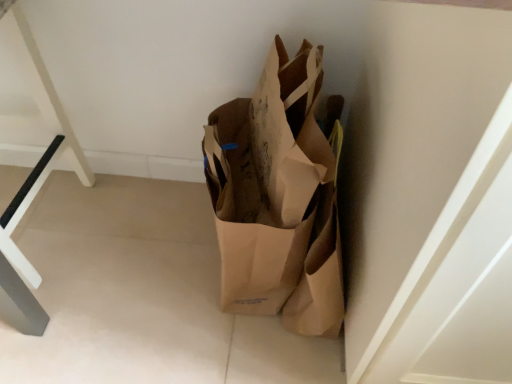
Question: Is point (28, 314) closer or farther from the camera than point (286, 79)?

Choices:
 (A) closer
 (B) farther

Answer: (B)

Question: From a real-world perspective, is white plastic table at left positioned above or below brown paper bag at center?

Choices:
 (A) below
 (B) above

Answer: (B)

Question: Would you say white plastic table at left is to the left or to the right of brown paper bag at center in the picture?

Choices:
 (A) left
 (B) right

Answer: (A)

Question: Considering the positions of brown paper bag at center and white plastic table at left in the image, is brown paper bag at center wider or thinner than white plastic table at left?

Choices:
 (A) thin
 (B) wide

Answer: (B)

Question: Considering the positions of point (205, 170) and point (9, 291), is point (205, 170) closer or farther from the camera than point (9, 291)?

Choices:
 (A) farther
 (B) closer

Answer: (A)

Question: Is brown paper bag at center in front of or behind white plastic table at left in the image?

Choices:
 (A) behind
 (B) front

Answer: (B)

Question: Considering the positions of brown paper bag at center and white plastic table at left in the image, is brown paper bag at center bigger or smaller than white plastic table at left?

Choices:
 (A) small
 (B) big

Answer: (B)